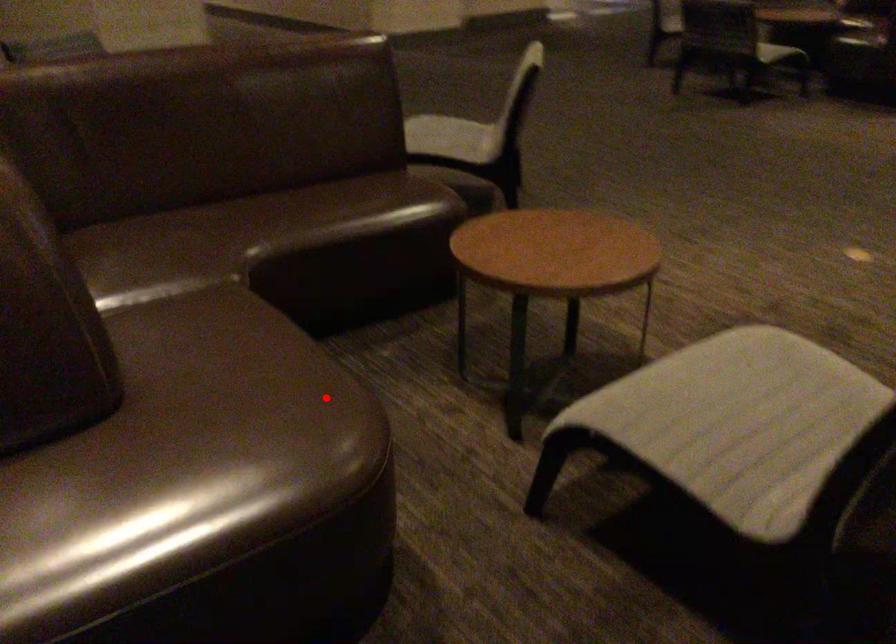
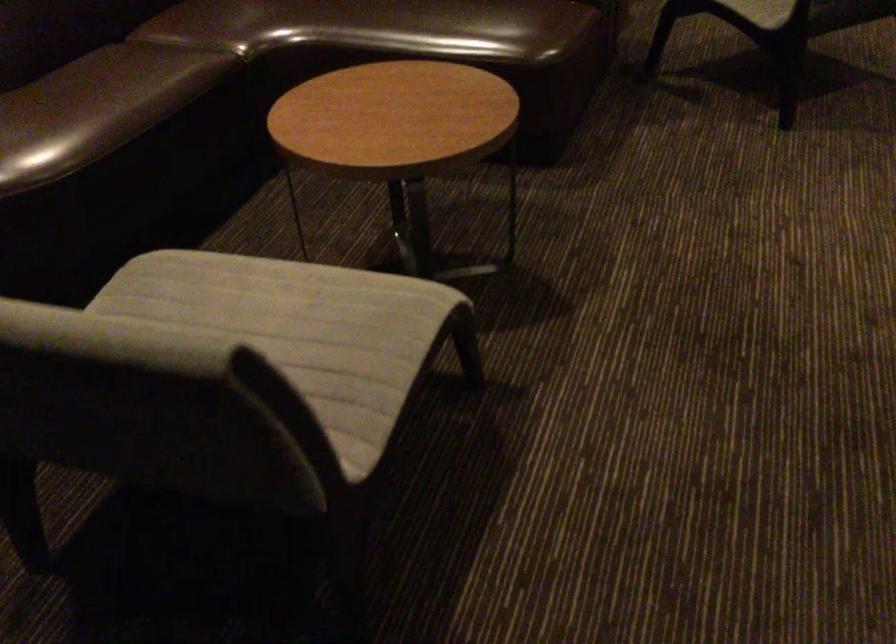
Question: I am providing you with two images of the same scene from different viewpoints. Given a red point in image1, look at the same physical point in image2. Is it:

Choices:
 (A) Closer to the viewpoint
 (B) Farther from the viewpoint

Answer: (B)